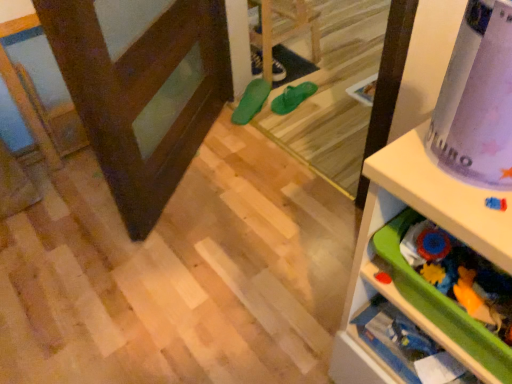
Identify the location of blank space to the left of dark brown wood screen door at left. (57, 203).